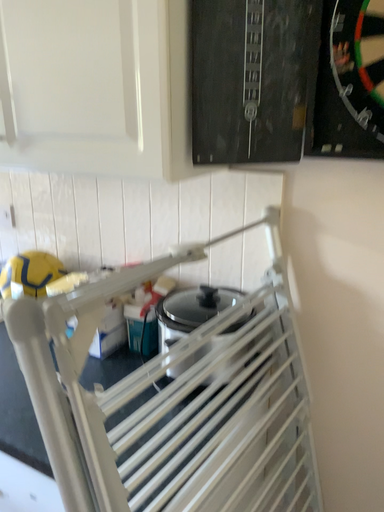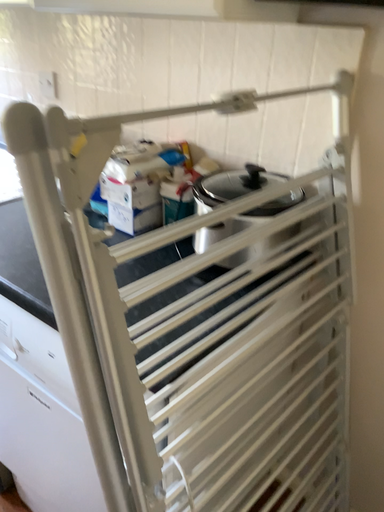
Question: How did the camera likely rotate when shooting the video?

Choices:
 (A) rotated left
 (B) rotated right

Answer: (A)